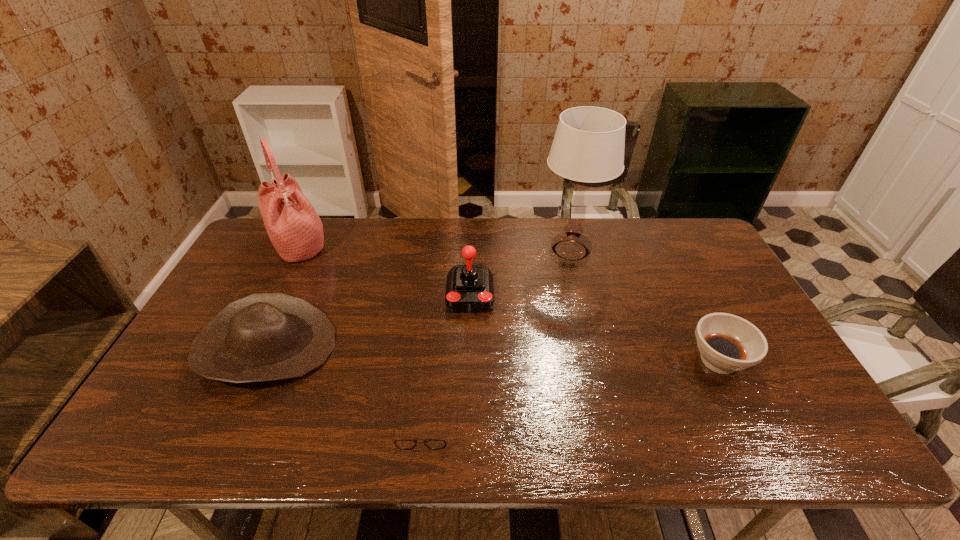
Locate an element on the screen. vacant space located on the front-facing side of the tallest object is located at coordinates (452, 250).

Locate an element on the screen. The image size is (960, 540). vacant space located 0.310m on the right of the second tallest object is located at coordinates (420, 247).

Where is `free space located on the base of the joystick`? free space located on the base of the joystick is located at coordinates (468, 353).

At what (x,y) coordinates should I click in order to perform the action: click on free spot located on the back of the cowboy hat. Please return your answer as a coordinate pair (x, y). Image resolution: width=960 pixels, height=540 pixels. Looking at the image, I should click on tap(316, 240).

This screenshot has height=540, width=960. Find the location of `vacant space situated 0.090m on the left of the second shortest object`. vacant space situated 0.090m on the left of the second shortest object is located at coordinates (653, 360).

This screenshot has width=960, height=540. Find the location of `table lamp at the far edge`. table lamp at the far edge is located at coordinates (588, 147).

At what (x,y) coordinates should I click in order to perform the action: click on handbag at the far edge. Please return your answer as a coordinate pair (x, y). This screenshot has width=960, height=540. Looking at the image, I should click on (295, 229).

I want to click on object positioned at the near edge, so click(406, 444).

The image size is (960, 540). Identify the location of handbag that is at the left edge. (295, 229).

Where is `cowboy hat that is at the left edge`? cowboy hat that is at the left edge is located at coordinates click(x=265, y=336).